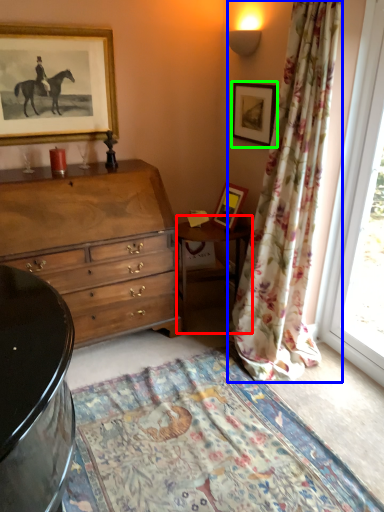
Question: Which object is the closest to the table (highlighted by a red box)? Choose among these: curtain (highlighted by a blue box) or picture frame (highlighted by a green box).

Choices:
 (A) curtain
 (B) picture frame

Answer: (A)